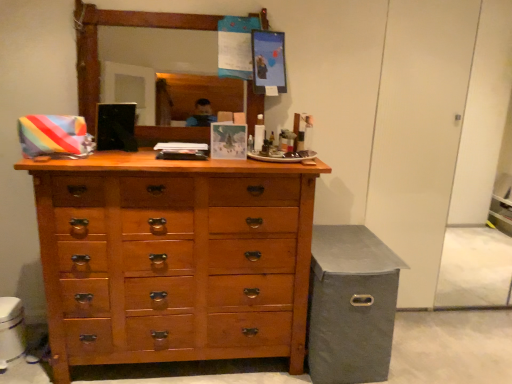
Image resolution: width=512 pixels, height=384 pixels. What do you see at coordinates (351, 305) in the screenshot?
I see `gray fabric storage bin at lower right` at bounding box center [351, 305].

What is the approximate width of gray fabric storage bin at lower right?

gray fabric storage bin at lower right is 24.11 inches wide.

I want to click on gray fabric storage bin at lower right, so click(351, 305).

At what (x,y) coordinates should I click in order to perform the action: click on wooden chest of drawers at center. Please return your answer as a coordinate pair (x, y). The height and width of the screenshot is (384, 512). Looking at the image, I should click on (174, 258).

What do you see at coordinates (174, 258) in the screenshot?
I see `wooden chest of drawers at center` at bounding box center [174, 258].

The height and width of the screenshot is (384, 512). What are the coordinates of `gray fabric storage bin at lower right` in the screenshot? It's located at (351, 305).

Does gray fabric storage bin at lower right appear on the left side of wooden chest of drawers at center?

Incorrect, gray fabric storage bin at lower right is not on the left side of wooden chest of drawers at center.

Considering the positions of objects gray fabric storage bin at lower right and wooden chest of drawers at center in the image provided, who is behind, gray fabric storage bin at lower right or wooden chest of drawers at center?

gray fabric storage bin at lower right is behind.

Is point (342, 320) closer or farther from the camera than point (158, 185)?

Point (342, 320).

From the image's perspective, between gray fabric storage bin at lower right and wooden chest of drawers at center, who is located below?

gray fabric storage bin at lower right appears lower in the image.

From a real-world perspective, is gray fabric storage bin at lower right under wooden chest of drawers at center?

Yes, from a real-world perspective, gray fabric storage bin at lower right is below wooden chest of drawers at center.

Considering the sizes of objects gray fabric storage bin at lower right and wooden chest of drawers at center in the image provided, who is wider, gray fabric storage bin at lower right or wooden chest of drawers at center?

Wider between the two is gray fabric storage bin at lower right.

Which of these two, gray fabric storage bin at lower right or wooden chest of drawers at center, stands taller?

wooden chest of drawers at center is taller.

Can you confirm if gray fabric storage bin at lower right is bigger than wooden chest of drawers at center?

Actually, gray fabric storage bin at lower right might be smaller than wooden chest of drawers at center.

Is wooden chest of drawers at center surrounded by gray fabric storage bin at lower right?

No.

Is gray fabric storage bin at lower right far away from wooden chest of drawers at center?

No, gray fabric storage bin at lower right is not far from wooden chest of drawers at center.

Is gray fabric storage bin at lower right positioned with its back to wooden chest of drawers at center?

No.

You are a GUI agent. You are given a task and a screenshot of the screen. Output one action in this format:
    pyautogui.click(x=<x>, y=<y>)
    Task: Click on the cabinetry below the wooden chest of drawers at center (from a real-world perspective)
    
    Given the screenshot: What is the action you would take?
    pyautogui.click(x=351, y=305)

Between wooden chest of drawers at center and gray fabric storage bin at lower right, which one appears on the right side from the viewer's perspective?

gray fabric storage bin at lower right.

Which object is further away from the camera, wooden chest of drawers at center or gray fabric storage bin at lower right?

gray fabric storage bin at lower right.

Which is closer to the camera, (83, 168) or (327, 346)?

Point (83, 168) appears to be closer to the viewer than point (327, 346).

From the image's perspective, who appears lower, wooden chest of drawers at center or gray fabric storage bin at lower right?

From the image's view, gray fabric storage bin at lower right is below.

From a real-world perspective, relative to gray fabric storage bin at lower right, is wooden chest of drawers at center vertically above or below?

Clearly, from a real-world perspective, wooden chest of drawers at center is above gray fabric storage bin at lower right.

In the scene shown: Which of these two, wooden chest of drawers at center or gray fabric storage bin at lower right, is wider?

gray fabric storage bin at lower right is wider.

Who is shorter, wooden chest of drawers at center or gray fabric storage bin at lower right?

gray fabric storage bin at lower right.

Who is bigger, wooden chest of drawers at center or gray fabric storage bin at lower right?

With larger size is wooden chest of drawers at center.

Is wooden chest of drawers at center situated inside gray fabric storage bin at lower right or outside?

wooden chest of drawers at center exists outside the volume of gray fabric storage bin at lower right.

Is the surface of wooden chest of drawers at center in direct contact with gray fabric storage bin at lower right?

wooden chest of drawers at center and gray fabric storage bin at lower right are not in contact.

Is wooden chest of drawers at center aimed at gray fabric storage bin at lower right?

No, wooden chest of drawers at center does not turn towards gray fabric storage bin at lower right.

Measure the distance between wooden chest of drawers at center and gray fabric storage bin at lower right.

wooden chest of drawers at center is 17.96 inches from gray fabric storage bin at lower right.

Locate an element on the screen. the chest of drawers that is above the gray fabric storage bin at lower right (from a real-world perspective) is located at coordinates (174, 258).

This screenshot has height=384, width=512. In the image, there is a wooden chest of drawers at center. Identify the location of cabinetry below it (from a real-world perspective). (351, 305).

Where is `the chest of drawers in front of the gray fabric storage bin at lower right`? The width and height of the screenshot is (512, 384). the chest of drawers in front of the gray fabric storage bin at lower right is located at coordinates (174, 258).